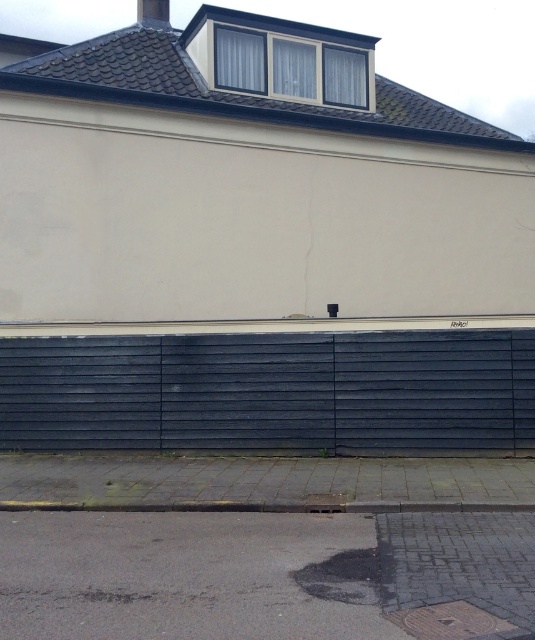
Question: Which object is positioned farthest from the dark asphalt pavement at lower center?

Choices:
 (A) dark gray wood fence at lower center
 (B) gray concrete curb at lower center

Answer: (A)

Question: Which point is closer to the camera taking this photo?

Choices:
 (A) (11, 401)
 (B) (67, 566)
 (C) (27, 508)

Answer: (B)

Question: Where is dark gray wood fence at lower center located in relation to gray concrete curb at lower center in the image?

Choices:
 (A) below
 (B) above

Answer: (B)

Question: From the image, what is the correct spatial relationship of dark asphalt pavement at lower center in relation to gray concrete curb at lower center?

Choices:
 (A) below
 (B) above

Answer: (A)

Question: Does dark asphalt pavement at lower center appear on the right side of gray concrete curb at lower center?

Choices:
 (A) no
 (B) yes

Answer: (B)

Question: Based on their relative distances, which object is farther from the dark asphalt pavement at lower center?

Choices:
 (A) gray concrete curb at lower center
 (B) dark gray wood fence at lower center

Answer: (B)